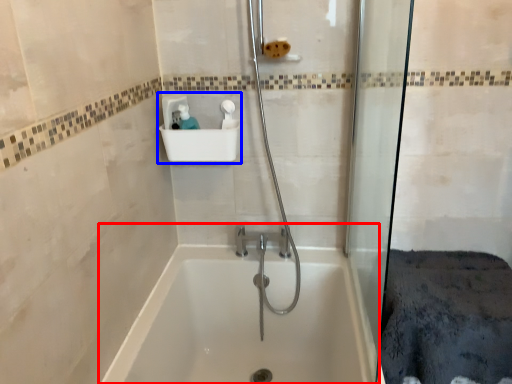
Question: Among these objects, which one is nearest to the camera, bathtub (highlighted by a red box) or sink (highlighted by a blue box)?

Choices:
 (A) bathtub
 (B) sink

Answer: (A)